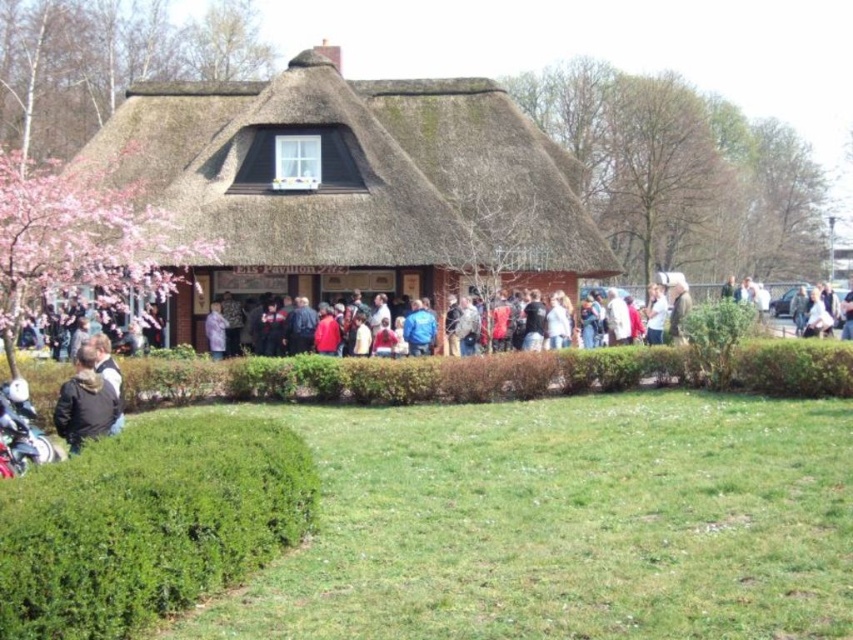
Is green leafy hedge at lower left wider than purple fabric at center?

Indeed, green leafy hedge at lower left has a greater width compared to purple fabric at center.

Is green leafy hedge at lower left taller than purple fabric at center?

No, green leafy hedge at lower left is not taller than purple fabric at center.

What do you see at coordinates (148, 524) in the screenshot?
I see `green leafy hedge at lower left` at bounding box center [148, 524].

I want to click on green leafy hedge at lower left, so click(148, 524).

Is point (149, 598) positioned behind point (788, 368)?

No, (149, 598) is closer to viewer.

Looking at this image, can you confirm if green leafy hedge at lower left is thinner than green leafy hedge at center?

Yes, green leafy hedge at lower left is thinner than green leafy hedge at center.

This screenshot has height=640, width=853. In order to click on green leafy hedge at lower left in this screenshot , I will do `click(148, 524)`.

Where is `green leafy hedge at lower left`? The image size is (853, 640). green leafy hedge at lower left is located at coordinates (148, 524).

Is point (219, 198) more distant than point (485, 396)?

That is True.

Can you confirm if thatched roof cottage at center is positioned above green leafy hedge at center?

Yes.

What do you see at coordinates (349, 184) in the screenshot? Image resolution: width=853 pixels, height=640 pixels. I see `thatched roof cottage at center` at bounding box center [349, 184].

At what (x,y) coordinates should I click in order to perform the action: click on thatched roof cottage at center. Please return your answer as a coordinate pair (x, y). The width and height of the screenshot is (853, 640). Looking at the image, I should click on (349, 184).